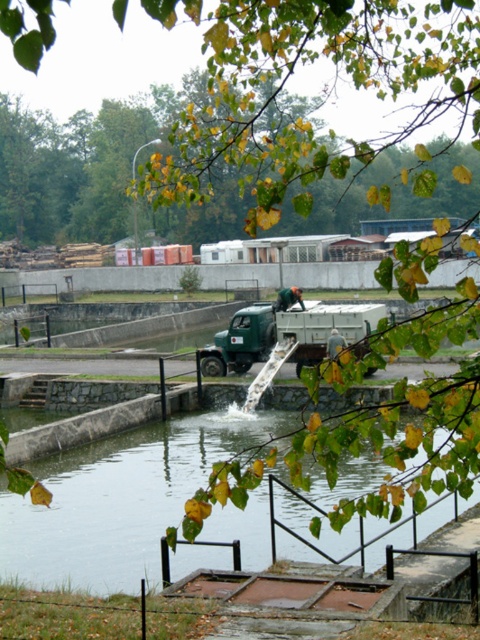
Question: In this image, where is clear concrete water at center located relative to green matte truck at center?

Choices:
 (A) right
 (B) left

Answer: (B)

Question: Which point is farther to the camera?

Choices:
 (A) green matte truck at center
 (B) clear concrete water at center

Answer: (A)

Question: From the image, what is the correct spatial relationship of clear concrete water at center in relation to green matte truck at center?

Choices:
 (A) right
 (B) left

Answer: (B)

Question: Which of the following is the farthest from the observer?

Choices:
 (A) (244, 316)
 (B) (343, 532)

Answer: (A)

Question: Among these objects, which one is farthest from the camera?

Choices:
 (A) green matte truck at center
 (B) clear concrete water at center

Answer: (A)

Question: Does clear concrete water at center have a greater width compared to green matte truck at center?

Choices:
 (A) yes
 (B) no

Answer: (A)